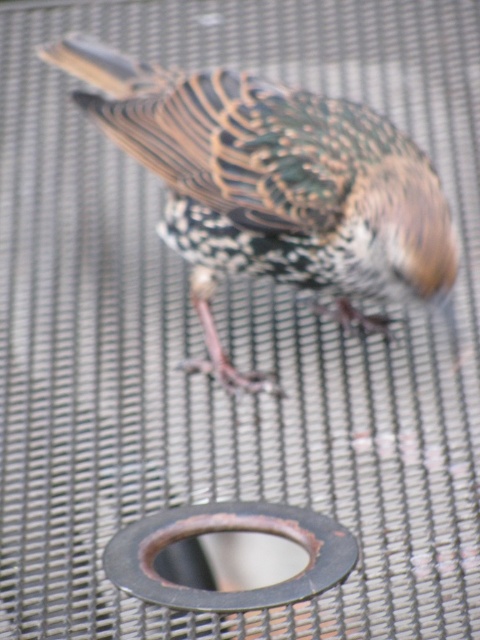
Question: In this image, where is speckled feathered bird at center located relative to rusty metal drain at center?

Choices:
 (A) left
 (B) right

Answer: (A)

Question: Which point appears farthest from the camera in this image?

Choices:
 (A) (142, 541)
 (B) (217, 77)

Answer: (B)

Question: Considering the relative positions of speckled feathered bird at center and rusty metal drain at center in the image provided, where is speckled feathered bird at center located with respect to rusty metal drain at center?

Choices:
 (A) right
 (B) left

Answer: (B)

Question: Does speckled feathered bird at center have a smaller size compared to rusty metal drain at center?

Choices:
 (A) yes
 (B) no

Answer: (B)